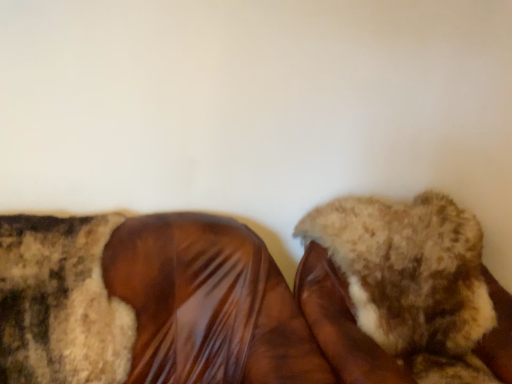
The image size is (512, 384). Identify the location of fuzzy fabric shoe at center, which is the 1th footwear in right-to-left order. (412, 279).

Describe the element at coordinates (412, 279) in the screenshot. I see `fuzzy fabric shoe at center, which is the 1th footwear in right-to-left order` at that location.

What is the approximate height of shiny brown shoe at center, positioned as the 2th footwear in right-to-left order?

It is 38.63 inches.

The width and height of the screenshot is (512, 384). Describe the element at coordinates (208, 304) in the screenshot. I see `shiny brown shoe at center, which is counted as the first footwear, starting from the left` at that location.

The width and height of the screenshot is (512, 384). Identify the location of shiny brown shoe at center, which is counted as the first footwear, starting from the left. (208, 304).

Identify the location of fuzzy fabric shoe at center, positioned as the second footwear in left-to-right order. (412, 279).

In the image, is fuzzy fabric shoe at center, which is the 1th footwear in right-to-left order, on the left side or the right side of shiny brown shoe at center, positioned as the 2th footwear in right-to-left order?

Based on their positions, fuzzy fabric shoe at center, which is the 1th footwear in right-to-left order, is located to the right of shiny brown shoe at center, positioned as the 2th footwear in right-to-left order.

Looking at this image, considering the positions of objects fuzzy fabric shoe at center, positioned as the second footwear in left-to-right order, and shiny brown shoe at center, positioned as the 2th footwear in right-to-left order, in the image provided, who is in front, fuzzy fabric shoe at center, positioned as the second footwear in left-to-right order, or shiny brown shoe at center, positioned as the 2th footwear in right-to-left order,?

shiny brown shoe at center, positioned as the 2th footwear in right-to-left order, is more forward.

Does point (443, 219) come farther from viewer compared to point (300, 340)?

Yes, it is.

From the image's perspective, is fuzzy fabric shoe at center, which is the 1th footwear in right-to-left order, located beneath shiny brown shoe at center, which is counted as the first footwear, starting from the left?

No, from the image's perspective, fuzzy fabric shoe at center, which is the 1th footwear in right-to-left order, is not beneath shiny brown shoe at center, which is counted as the first footwear, starting from the left.

From a real-world perspective, which is physically above, fuzzy fabric shoe at center, positioned as the second footwear in left-to-right order, or shiny brown shoe at center, positioned as the 2th footwear in right-to-left order?

fuzzy fabric shoe at center, positioned as the second footwear in left-to-right order, from a real-world perspective.

Is fuzzy fabric shoe at center, which is the 1th footwear in right-to-left order, thinner than shiny brown shoe at center, positioned as the 2th footwear in right-to-left order?

Incorrect, the width of fuzzy fabric shoe at center, which is the 1th footwear in right-to-left order, is not less than that of shiny brown shoe at center, positioned as the 2th footwear in right-to-left order.

In the scene shown: Between fuzzy fabric shoe at center, which is the 1th footwear in right-to-left order, and shiny brown shoe at center, positioned as the 2th footwear in right-to-left order, which one has less height?

With less height is fuzzy fabric shoe at center, which is the 1th footwear in right-to-left order.

Looking at this image, who is smaller, fuzzy fabric shoe at center, which is the 1th footwear in right-to-left order, or shiny brown shoe at center, positioned as the 2th footwear in right-to-left order?

fuzzy fabric shoe at center, which is the 1th footwear in right-to-left order, is smaller.

Is fuzzy fabric shoe at center, positioned as the second footwear in left-to-right order, inside or outside of shiny brown shoe at center, which is counted as the first footwear, starting from the left?

fuzzy fabric shoe at center, positioned as the second footwear in left-to-right order, is outside shiny brown shoe at center, which is counted as the first footwear, starting from the left.

Are fuzzy fabric shoe at center, positioned as the second footwear in left-to-right order, and shiny brown shoe at center, which is counted as the first footwear, starting from the left, making contact?

No.

Is fuzzy fabric shoe at center, positioned as the second footwear in left-to-right order, facing towards shiny brown shoe at center, positioned as the 2th footwear in right-to-left order?

No, fuzzy fabric shoe at center, positioned as the second footwear in left-to-right order, is not aimed at shiny brown shoe at center, positioned as the 2th footwear in right-to-left order.

You are a GUI agent. You are given a task and a screenshot of the screen. Output one action in this format:
    pyautogui.click(x=<x>, y=<y>)
    Task: Click on the footwear below the fuzzy fabric shoe at center, positioned as the second footwear in left-to-right order (from the image's perspective)
    The image size is (512, 384).
    Given the screenshot: What is the action you would take?
    pyautogui.click(x=208, y=304)

Is shiny brown shoe at center, which is counted as the first footwear, starting from the left, at the right side of fuzzy fabric shoe at center, positioned as the second footwear in left-to-right order?

In fact, shiny brown shoe at center, which is counted as the first footwear, starting from the left, is to the left of fuzzy fabric shoe at center, positioned as the second footwear in left-to-right order.

Is the position of shiny brown shoe at center, which is counted as the first footwear, starting from the left, less distant than that of fuzzy fabric shoe at center, positioned as the second footwear in left-to-right order?

Yes, it is.

Which is behind, point (215, 326) or point (387, 270)?

The point (387, 270) is behind.

From the image's perspective, is shiny brown shoe at center, which is counted as the first footwear, starting from the left, on top of fuzzy fabric shoe at center, positioned as the second footwear in left-to-right order?

No, from the image's perspective, shiny brown shoe at center, which is counted as the first footwear, starting from the left, is not on top of fuzzy fabric shoe at center, positioned as the second footwear in left-to-right order.

Consider the image. From a real-world perspective, is shiny brown shoe at center, which is counted as the first footwear, starting from the left, on fuzzy fabric shoe at center, which is the 1th footwear in right-to-left order?

No, from a real-world perspective, shiny brown shoe at center, which is counted as the first footwear, starting from the left, is not on top of fuzzy fabric shoe at center, which is the 1th footwear in right-to-left order.

Between shiny brown shoe at center, which is counted as the first footwear, starting from the left, and fuzzy fabric shoe at center, positioned as the second footwear in left-to-right order, which one has larger width?

With larger width is fuzzy fabric shoe at center, positioned as the second footwear in left-to-right order.

Considering the relative sizes of shiny brown shoe at center, which is counted as the first footwear, starting from the left, and fuzzy fabric shoe at center, positioned as the second footwear in left-to-right order, in the image provided, is shiny brown shoe at center, which is counted as the first footwear, starting from the left, taller than fuzzy fabric shoe at center, positioned as the second footwear in left-to-right order,?

Indeed, shiny brown shoe at center, which is counted as the first footwear, starting from the left, has a greater height compared to fuzzy fabric shoe at center, positioned as the second footwear in left-to-right order.

Considering the sizes of objects shiny brown shoe at center, which is counted as the first footwear, starting from the left, and fuzzy fabric shoe at center, positioned as the second footwear in left-to-right order, in the image provided, who is bigger, shiny brown shoe at center, which is counted as the first footwear, starting from the left, or fuzzy fabric shoe at center, positioned as the second footwear in left-to-right order,?

shiny brown shoe at center, which is counted as the first footwear, starting from the left.

Is shiny brown shoe at center, which is counted as the first footwear, starting from the left, spatially inside fuzzy fabric shoe at center, which is the 1th footwear in right-to-left order, or outside of it?

shiny brown shoe at center, which is counted as the first footwear, starting from the left, is not enclosed by fuzzy fabric shoe at center, which is the 1th footwear in right-to-left order.

Is shiny brown shoe at center, positioned as the 2th footwear in right-to-left order, beside fuzzy fabric shoe at center, which is the 1th footwear in right-to-left order?

shiny brown shoe at center, positioned as the 2th footwear in right-to-left order, is not next to fuzzy fabric shoe at center, which is the 1th footwear in right-to-left order, and they're not touching.

Is shiny brown shoe at center, positioned as the 2th footwear in right-to-left order, aimed at fuzzy fabric shoe at center, which is the 1th footwear in right-to-left order?

No, shiny brown shoe at center, positioned as the 2th footwear in right-to-left order, is not turned towards fuzzy fabric shoe at center, which is the 1th footwear in right-to-left order.

Locate an element on the screen. footwear on the left of fuzzy fabric shoe at center, positioned as the second footwear in left-to-right order is located at coordinates (208, 304).

The image size is (512, 384). Identify the location of footwear above the shiny brown shoe at center, positioned as the 2th footwear in right-to-left order (from a real-world perspective). (412, 279).

In order to click on footwear behind the shiny brown shoe at center, positioned as the 2th footwear in right-to-left order in this screenshot , I will do `click(412, 279)`.